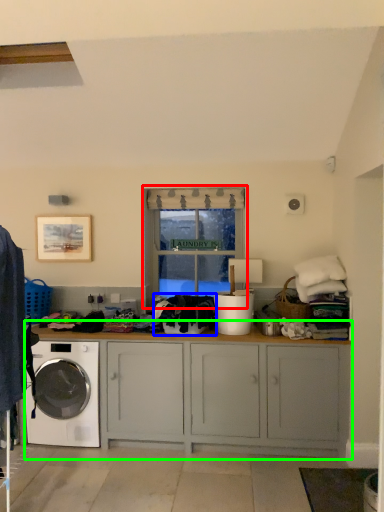
Question: Which object is positioned farthest from window (highlighted by a red box)? Select from clothing (highlighted by a blue box) and cabinetry (highlighted by a green box).

Choices:
 (A) clothing
 (B) cabinetry

Answer: (B)